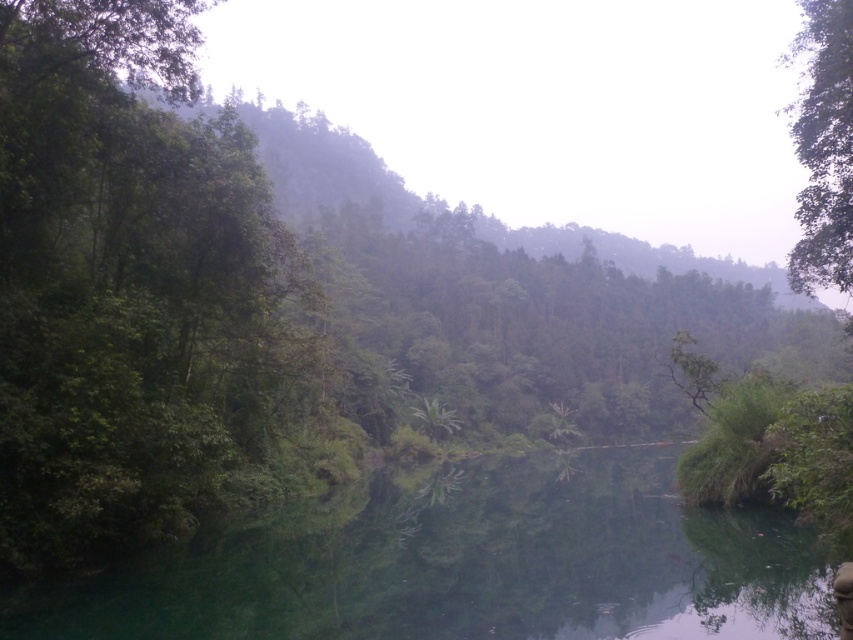
Is green glossy water at center thinner than green leafy tree at upper right?

Yes.

Does point (590, 467) come closer to viewer compared to point (805, 289)?

No, it is not.

Who is more forward, (253, 630) or (827, 12)?

Positioned in front is point (253, 630).

At what (x,y) coordinates should I click in order to perform the action: click on green glossy water at center. Please return your answer as a coordinate pair (x, y). Looking at the image, I should click on (469, 564).